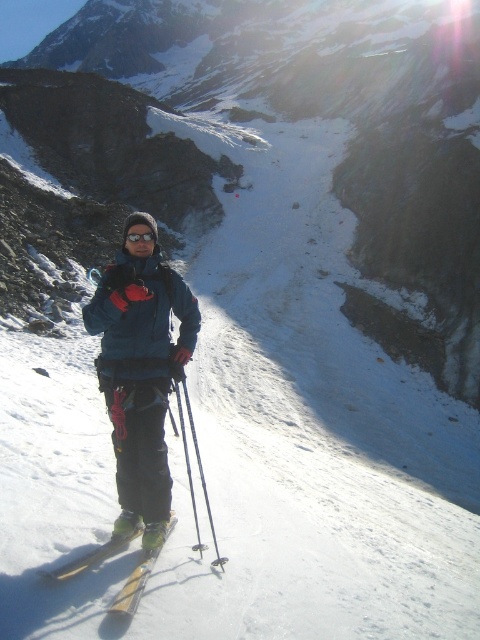
Question: Which object is the farthest from the yellow metallic ski at lower center?

Choices:
 (A) metallic silver ski pole at center
 (B) matte blue jacket at center

Answer: (A)

Question: Which object is positioned farthest from the yellow metallic ski at lower center?

Choices:
 (A) metallic silver ski pole at center
 (B) matte blue jacket at center

Answer: (A)

Question: Can you confirm if matte blue jacket at center is bigger than yellow metallic ski at lower center?

Choices:
 (A) no
 (B) yes

Answer: (B)

Question: Is yellow metallic ski at lower center to the right of metallic silver ski pole at center from the viewer's perspective?

Choices:
 (A) yes
 (B) no

Answer: (A)

Question: Considering the real-world distances, which object is farthest from the matte blue jacket at center?

Choices:
 (A) yellow metallic ski at lower center
 (B) metallic silver ski pole at center

Answer: (B)

Question: Does yellow metallic ski at lower center appear over metallic silver ski pole at center?

Choices:
 (A) no
 (B) yes

Answer: (A)